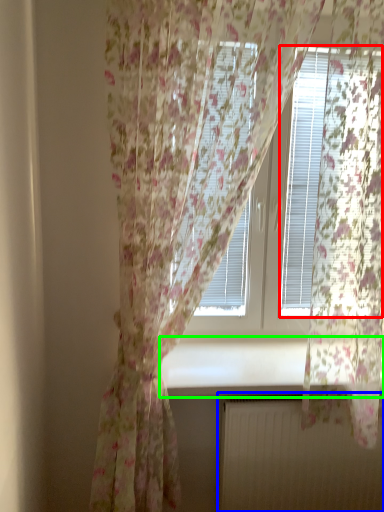
Question: Considering the real-world distances, which object is closest to blind (highlighted by a red box)? radiator (highlighted by a blue box) or window sill (highlighted by a green box).

Choices:
 (A) radiator
 (B) window sill

Answer: (B)